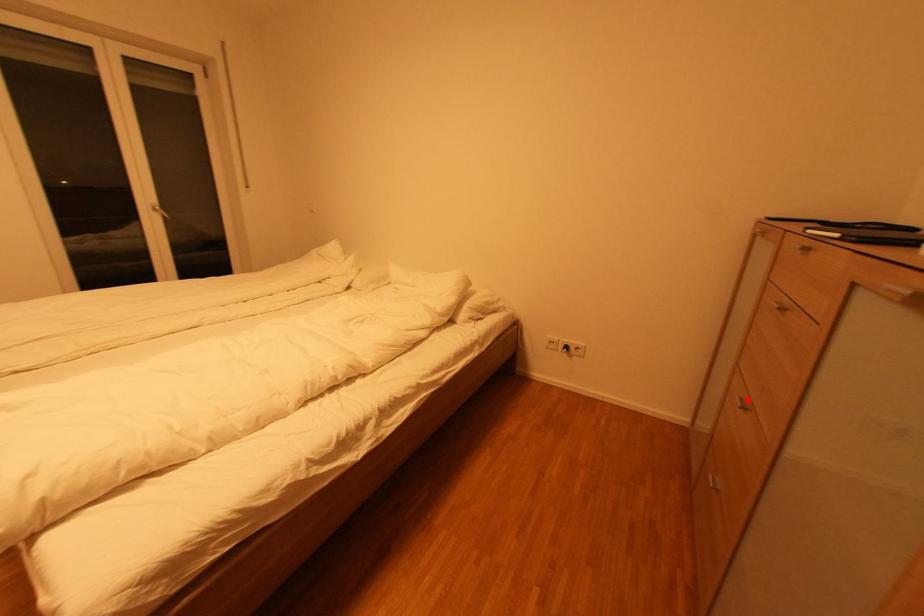
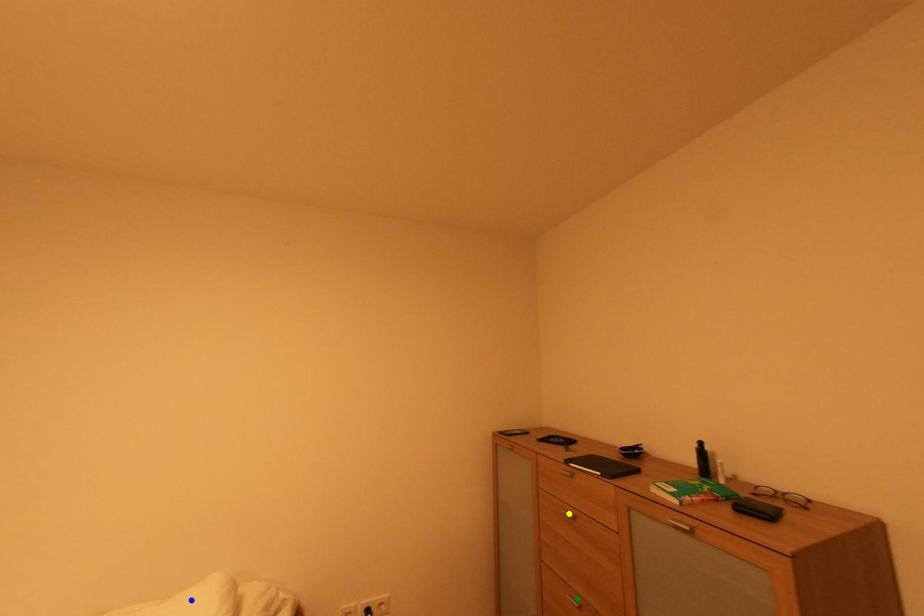
Question: I am providing you with two images of the same scene from different viewpoints. A red point is marked on the first image. You are given multiple points on the second image. Which spot in image 2 lines up with the point in image 1?

Choices:
 (A) yellow point
 (B) blue point
 (C) green point

Answer: (C)